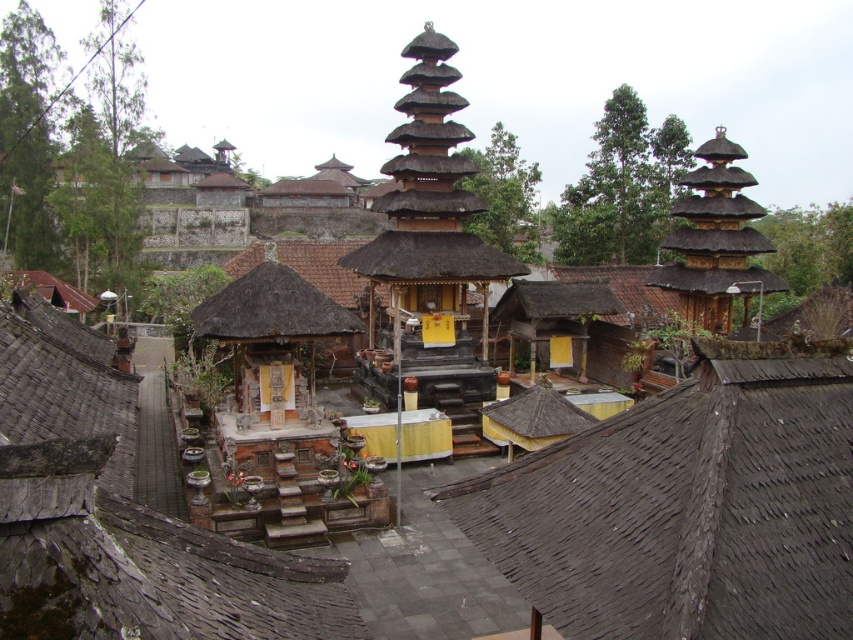
Question: Considering the relative positions of brown thatched roof at center and thatched wood tower at center in the image provided, where is brown thatched roof at center located with respect to thatched wood tower at center?

Choices:
 (A) above
 (B) below

Answer: (B)

Question: Does brown thatched roof at center appear over thatched wood tower at center?

Choices:
 (A) no
 (B) yes

Answer: (A)

Question: Which point appears closest to the camera in this image?

Choices:
 (A) (506, 253)
 (B) (569, 584)

Answer: (B)

Question: From the image, what is the correct spatial relationship of brown thatched roof at center in relation to thatched wood tower at center?

Choices:
 (A) left
 (B) right

Answer: (B)